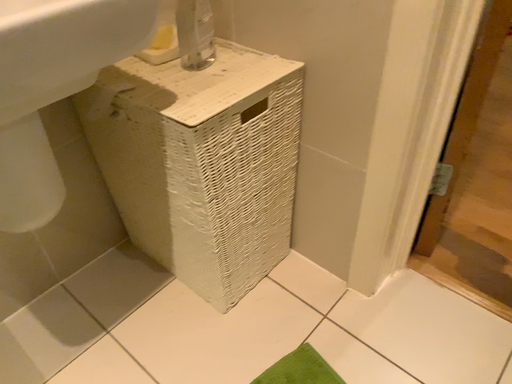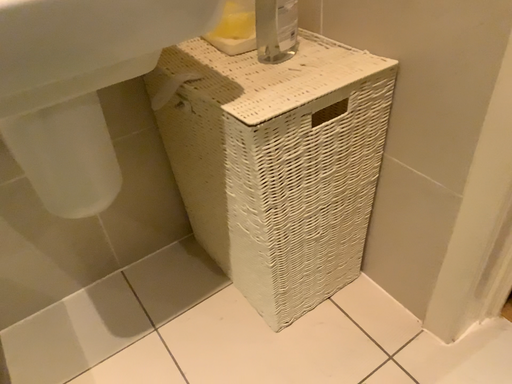
Question: Which way did the camera rotate in the video?

Choices:
 (A) rotated left
 (B) rotated right

Answer: (A)